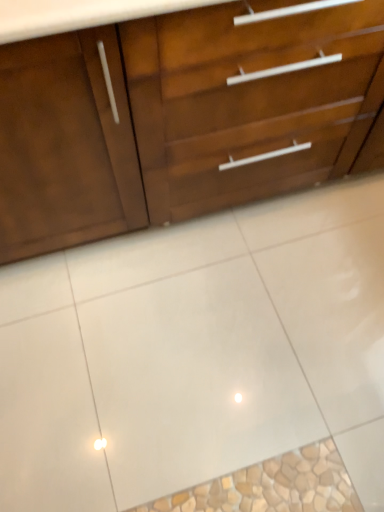
Question: Is white glossy tile at center taller than matte wood chest of drawers at upper center?

Choices:
 (A) yes
 (B) no

Answer: (B)

Question: Is white glossy tile at center in contact with matte wood chest of drawers at upper center?

Choices:
 (A) no
 (B) yes

Answer: (A)

Question: Considering the relative sizes of white glossy tile at center and matte wood chest of drawers at upper center in the image provided, is white glossy tile at center bigger than matte wood chest of drawers at upper center?

Choices:
 (A) yes
 (B) no

Answer: (B)

Question: Considering the relative sizes of white glossy tile at center and matte wood chest of drawers at upper center in the image provided, is white glossy tile at center shorter than matte wood chest of drawers at upper center?

Choices:
 (A) yes
 (B) no

Answer: (A)

Question: Is matte wood chest of drawers at upper center at the back of white glossy tile at center?

Choices:
 (A) no
 (B) yes

Answer: (A)

Question: Is white glossy tile at center at the right side of matte wood chest of drawers at upper center?

Choices:
 (A) yes
 (B) no

Answer: (A)

Question: Considering the relative positions of matte wood chest of drawers at upper center and white glossy tile at center in the image provided, is matte wood chest of drawers at upper center to the right of white glossy tile at center from the viewer's perspective?

Choices:
 (A) no
 (B) yes

Answer: (A)

Question: Does matte wood chest of drawers at upper center lie behind white glossy tile at center?

Choices:
 (A) no
 (B) yes

Answer: (A)

Question: From a real-world perspective, is matte wood chest of drawers at upper center positioned under white glossy tile at center based on gravity?

Choices:
 (A) yes
 (B) no

Answer: (B)

Question: Is there a large distance between matte wood chest of drawers at upper center and white glossy tile at center?

Choices:
 (A) yes
 (B) no

Answer: (B)

Question: From the image's perspective, is matte wood chest of drawers at upper center below white glossy tile at center?

Choices:
 (A) yes
 (B) no

Answer: (B)

Question: Does matte wood chest of drawers at upper center contain white glossy tile at center?

Choices:
 (A) yes
 (B) no

Answer: (B)

Question: Is white glossy tile at center wider or thinner than matte wood chest of drawers at upper center?

Choices:
 (A) thin
 (B) wide

Answer: (B)